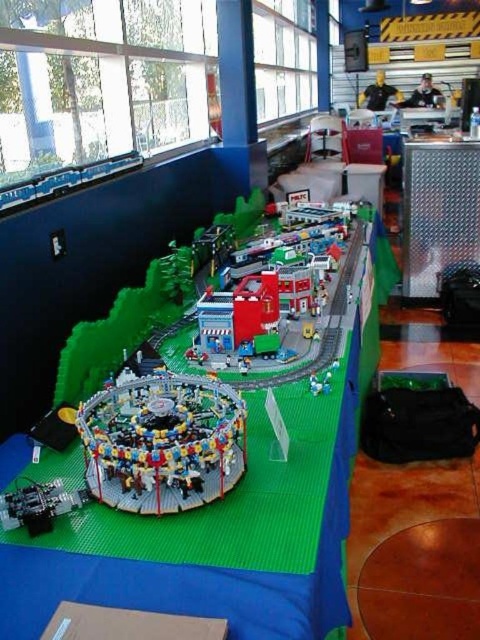
Who is more distant from viewer, (160, 508) or (9, 522)?

The point (160, 508) is more distant.

Describe the element at coordinates (163, 442) in the screenshot. I see `translucent plastic carousel at center` at that location.

I want to click on translucent plastic carousel at center, so click(163, 442).

Is the position of translucent plastic carousel at center less distant than that of brick red train station at center?

Yes, it is in front of brick red train station at center.

Between point (183, 400) and point (238, 353), which one is positioned in front?

Point (183, 400) is in front.

The width and height of the screenshot is (480, 640). What do you see at coordinates (163, 442) in the screenshot?
I see `translucent plastic carousel at center` at bounding box center [163, 442].

The width and height of the screenshot is (480, 640). I want to click on translucent plastic carousel at center, so click(x=163, y=442).

Does point (241, 356) lie in front of point (13, 525)?

No, it is not.

Which is more to the left, brick red train station at center or metallic gray train at lower left?

From the viewer's perspective, metallic gray train at lower left appears more on the left side.

I want to click on brick red train station at center, so click(267, 296).

You are a GUI agent. You are given a task and a screenshot of the screen. Output one action in this format:
    pyautogui.click(x=<x>, y=<y>)
    Task: Click on the brick red train station at center
    
    Given the screenshot: What is the action you would take?
    pyautogui.click(x=267, y=296)